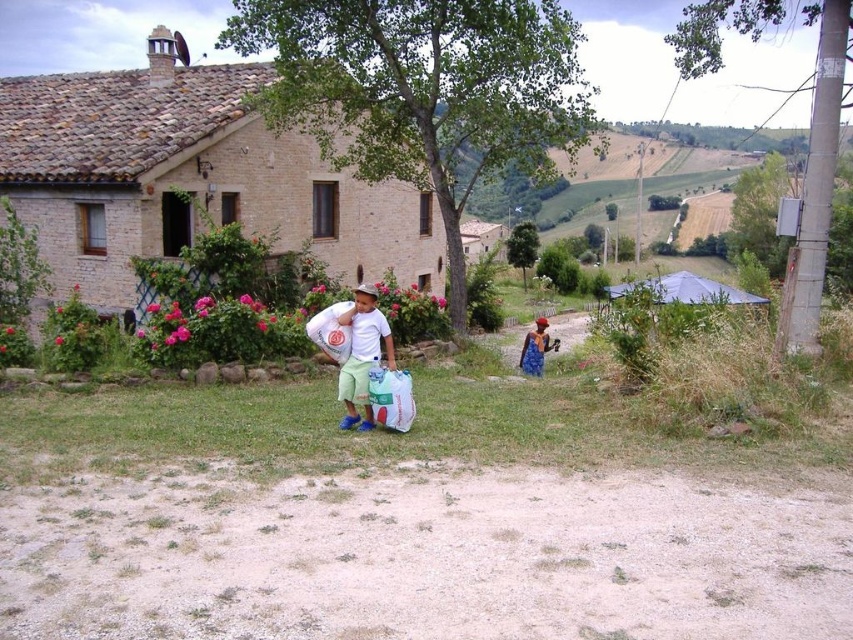
Question: Is white matte shirt at center positioned in front of blue denim dress at lower right?

Choices:
 (A) yes
 (B) no

Answer: (A)

Question: Does white matte shirt at center appear on the right side of blue denim dress at lower right?

Choices:
 (A) yes
 (B) no

Answer: (B)

Question: Does white matte shirt at center have a smaller size compared to blue denim dress at lower right?

Choices:
 (A) no
 (B) yes

Answer: (B)